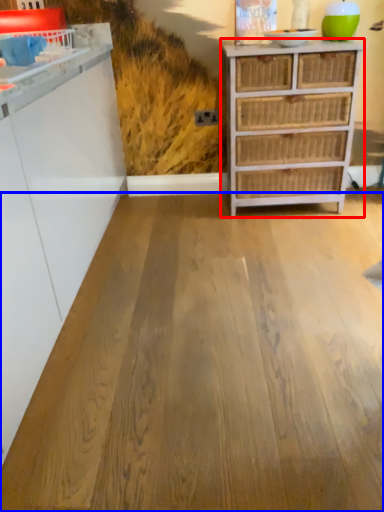
Question: Which object is further to the camera taking this photo, chest of drawers (highlighted by a red box) or plywood (highlighted by a blue box)?

Choices:
 (A) chest of drawers
 (B) plywood

Answer: (A)